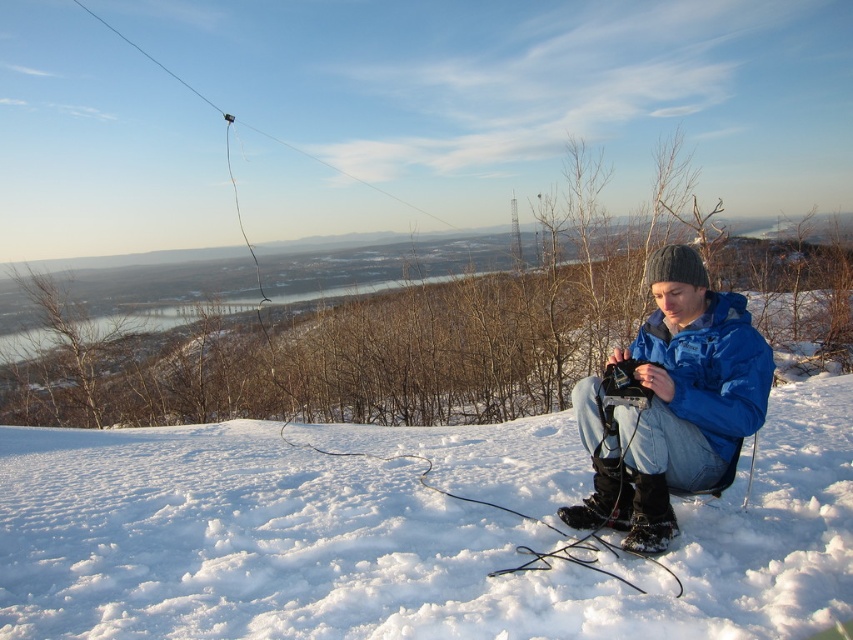
Question: Which object appears closest to the camera in this image?

Choices:
 (A) blue matte jacket at center
 (B) blue synthetic jacket at center

Answer: (B)

Question: Observing the image, what is the correct spatial positioning of white fluffy snow at center in reference to blue synthetic jacket at center?

Choices:
 (A) right
 (B) left

Answer: (B)

Question: Can you confirm if white fluffy snow at center is bigger than blue matte jacket at center?

Choices:
 (A) yes
 (B) no

Answer: (A)

Question: Does white fluffy snow at center have a greater width compared to blue matte jacket at center?

Choices:
 (A) no
 (B) yes

Answer: (B)

Question: Which of the following is the closest to the observer?

Choices:
 (A) [718, 509]
 (B) [699, 369]
 (C) [677, 321]

Answer: (B)

Question: Which point is closer to the camera?

Choices:
 (A) blue synthetic jacket at center
 (B) white fluffy snow at center
 (C) blue matte jacket at center

Answer: (B)